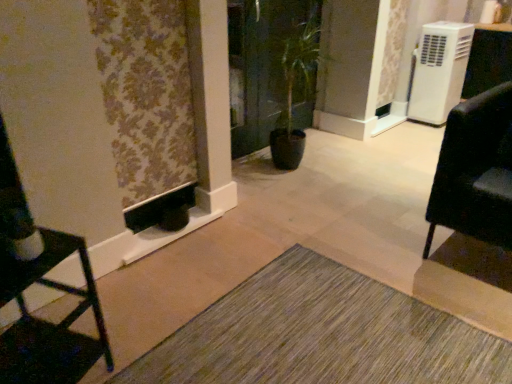
Question: Is matte black chair at left, acting as the first furniture starting from the left, to the left of floral fabric curtain at left from the viewer's perspective?

Choices:
 (A) yes
 (B) no

Answer: (A)

Question: Does matte black chair at left, acting as the first furniture starting from the left, have a smaller size compared to floral fabric curtain at left?

Choices:
 (A) yes
 (B) no

Answer: (B)

Question: Is matte black chair at left, the second furniture when ordered from right to left, placed right next to floral fabric curtain at left?

Choices:
 (A) yes
 (B) no

Answer: (B)

Question: Can you confirm if matte black chair at left, acting as the first furniture starting from the left, is wider than floral fabric curtain at left?

Choices:
 (A) no
 (B) yes

Answer: (B)

Question: Can floral fabric curtain at left be found inside matte black chair at left, acting as the first furniture starting from the front?

Choices:
 (A) no
 (B) yes

Answer: (A)

Question: Considering the relative sizes of matte black chair at left, acting as the first furniture starting from the left, and floral fabric curtain at left in the image provided, is matte black chair at left, acting as the first furniture starting from the left, thinner than floral fabric curtain at left?

Choices:
 (A) no
 (B) yes

Answer: (A)

Question: Is matte black chair at left, the second furniture when ordered from right to left, thinner than white plastic air conditioner at upper right?

Choices:
 (A) no
 (B) yes

Answer: (A)

Question: From a real-world perspective, is matte black chair at left, acting as the first furniture starting from the front, positioned under white plastic air conditioner at upper right based on gravity?

Choices:
 (A) no
 (B) yes

Answer: (B)

Question: Is matte black chair at left, the second furniture when ordered from right to left, outside white plastic air conditioner at upper right?

Choices:
 (A) no
 (B) yes

Answer: (B)

Question: Considering the relative sizes of matte black chair at left, the second furniture when ordered from right to left, and white plastic air conditioner at upper right in the image provided, is matte black chair at left, the second furniture when ordered from right to left, taller than white plastic air conditioner at upper right?

Choices:
 (A) no
 (B) yes

Answer: (A)

Question: Is white plastic air conditioner at upper right located within matte black chair at left, acting as the first furniture starting from the left?

Choices:
 (A) no
 (B) yes

Answer: (A)

Question: Can you confirm if matte black chair at left, acting as the first furniture starting from the left, is wider than white plastic air conditioner at upper right?

Choices:
 (A) no
 (B) yes

Answer: (B)

Question: Considering the relative sizes of white plastic air conditioner at upper right and matte black chair at left, the second furniture when ordered from right to left, in the image provided, is white plastic air conditioner at upper right smaller than matte black chair at left, the second furniture when ordered from right to left,?

Choices:
 (A) yes
 (B) no

Answer: (B)